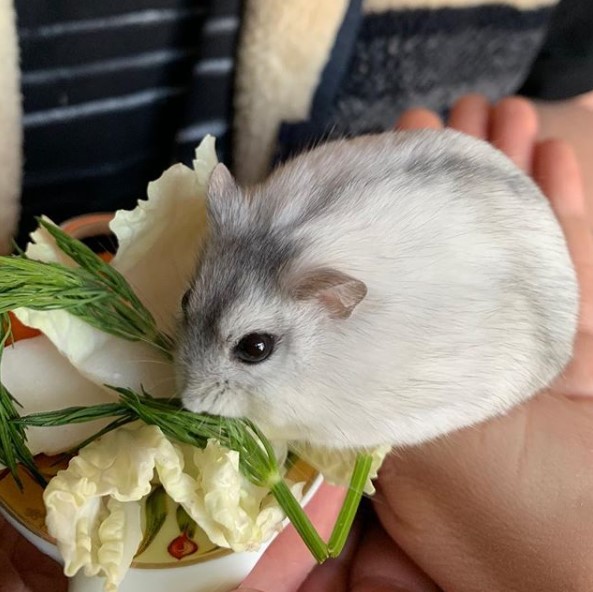
Find the location of a particular element. The width and height of the screenshot is (593, 592). green plant is located at coordinates click(x=184, y=422).